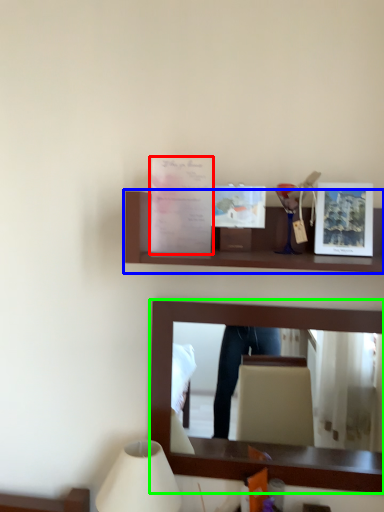
Question: Estimate the real-world distances between objects in this image. Which object is closer to postcard (highlighted by a red box), shelf (highlighted by a blue box) or mirror (highlighted by a green box)?

Choices:
 (A) shelf
 (B) mirror

Answer: (A)